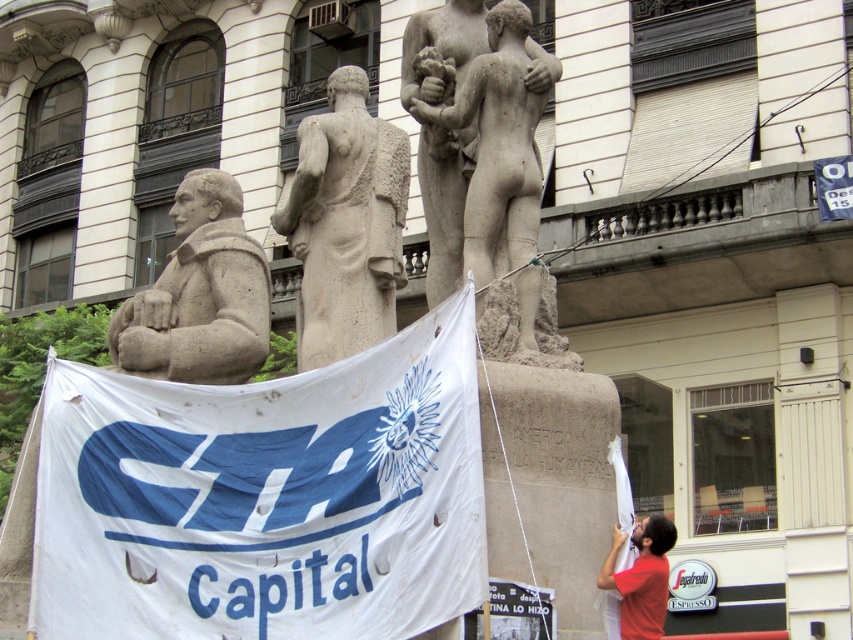
Question: Does white fabric banner at center lie behind red cotton shirt at lower right?

Choices:
 (A) no
 (B) yes

Answer: (A)

Question: Is white fabric banner at center wider than stone nude statue at center?

Choices:
 (A) no
 (B) yes

Answer: (B)

Question: Is stone statue at left above red cotton shirt at lower right?

Choices:
 (A) yes
 (B) no

Answer: (A)

Question: Based on their relative distances, which object is nearer to the red cotton shirt at lower right?

Choices:
 (A) stone nude statue at center
 (B) stone statue at center
 (C) white fabric banner at center
 (D) stone statue at left

Answer: (C)

Question: Based on their relative distances, which object is nearer to the stone statue at left?

Choices:
 (A) white fabric banner at center
 (B) stone statue at center

Answer: (B)

Question: Which of the following is the closest to the observer?

Choices:
 (A) stone nude statue at center
 (B) stone statue at left

Answer: (A)